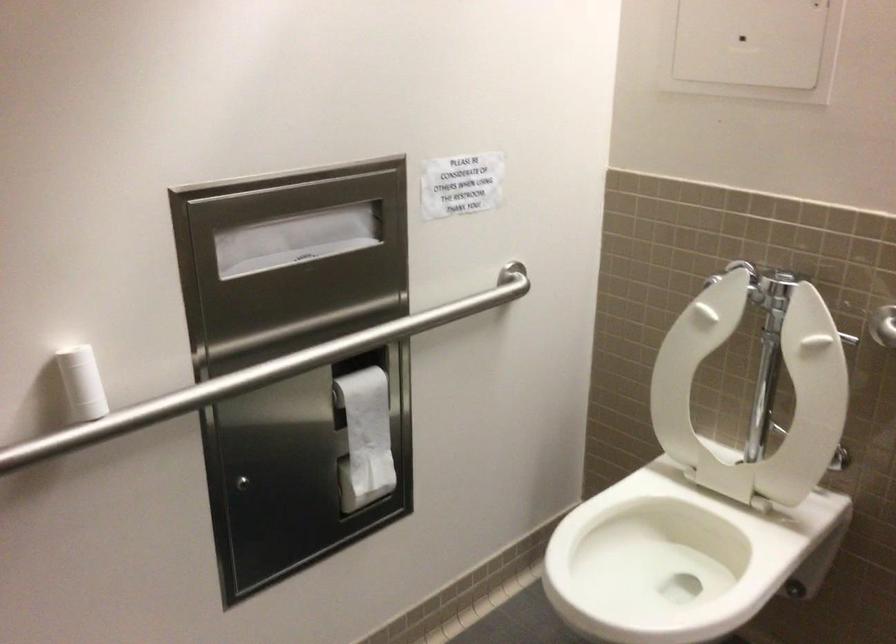
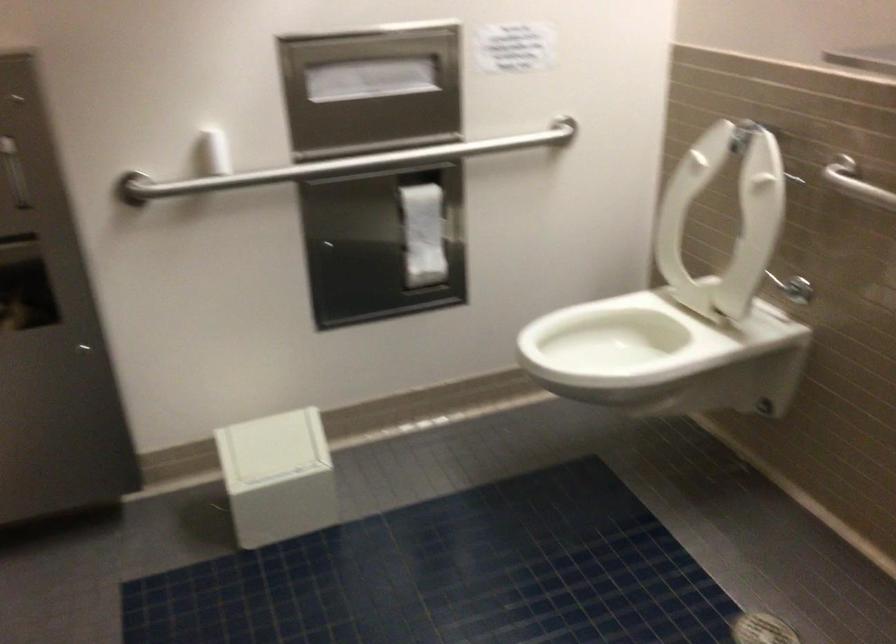
Where in the second image is the point corresponding to point 624,535 from the first image?

(616, 336)